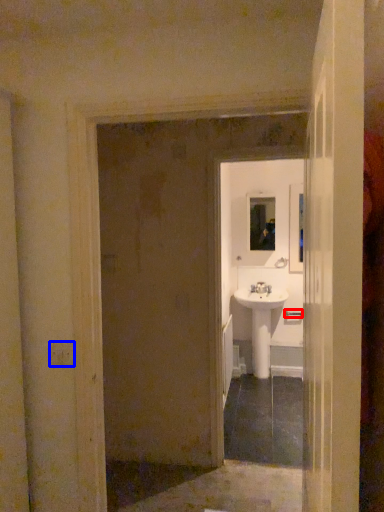
Question: Which of the following is the closest to the observer, door handle (highlighted by a red box) or light switch (highlighted by a blue box)?

Choices:
 (A) door handle
 (B) light switch

Answer: (B)